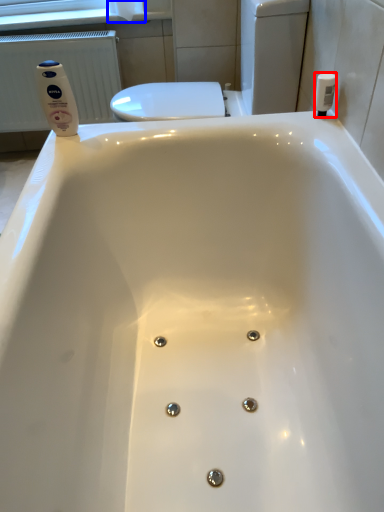
Question: Which object is closer to the camera taking this photo, toiletry (highlighted by a red box) or toilet paper (highlighted by a blue box)?

Choices:
 (A) toiletry
 (B) toilet paper

Answer: (A)